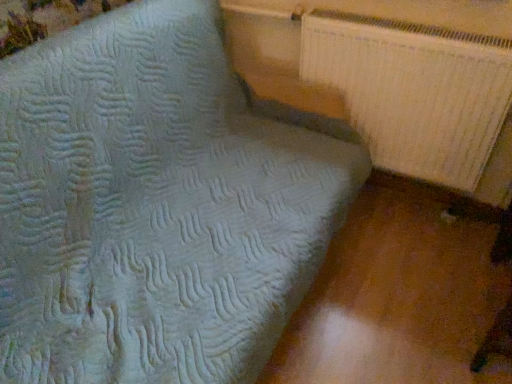
Where is `vacant space underneath white textured radiator at upper right (from a real-world perspective)`? vacant space underneath white textured radiator at upper right (from a real-world perspective) is located at coordinates (401, 198).